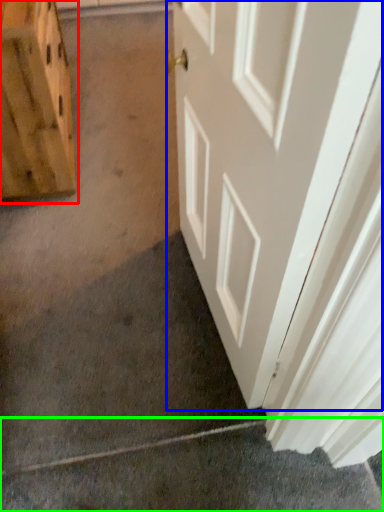
Question: Which object is positioned closest to cabinetry (highlighted by a red box)? Select from door (highlighted by a blue box) and concrete (highlighted by a green box).

Choices:
 (A) door
 (B) concrete

Answer: (A)